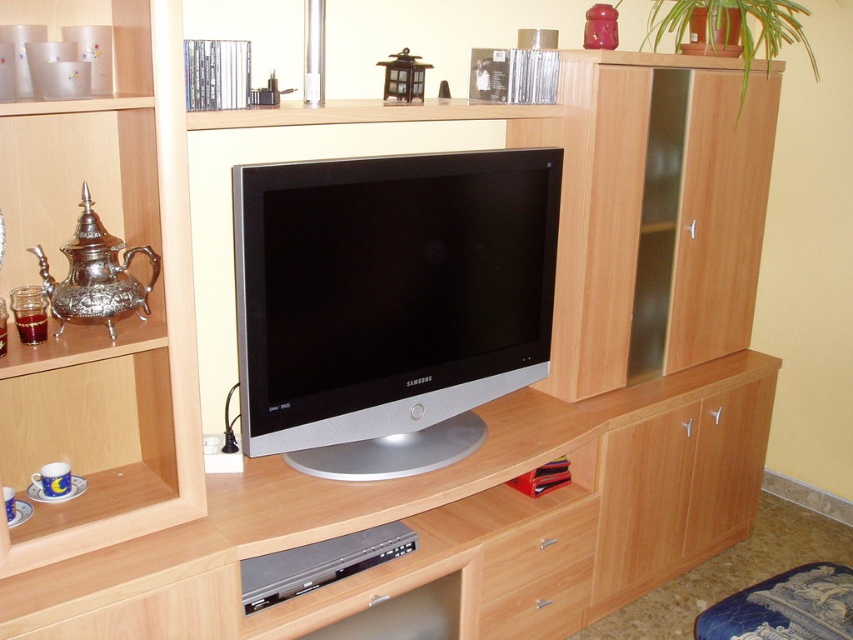
Question: Does matte silver teapot at left appear under wooden drawer at lower center?

Choices:
 (A) no
 (B) yes

Answer: (A)

Question: Based on their relative distances, which object is nearer to the satin silver flat at center?

Choices:
 (A) wooden drawer at lower center
 (B) matte silver teapot at left

Answer: (B)

Question: Does satin silver flat at center appear under wooden drawer at lower center?

Choices:
 (A) yes
 (B) no

Answer: (B)

Question: Which object appears farthest from the camera in this image?

Choices:
 (A) matte silver teapot at left
 (B) satin silver flat at center

Answer: (B)

Question: Observing the image, what is the correct spatial positioning of matte silver teapot at left in reference to wooden drawer at lower center?

Choices:
 (A) right
 (B) left

Answer: (B)

Question: Which is farther from the matte silver teapot at left?

Choices:
 (A) satin silver flat at center
 (B) wooden drawer at lower center

Answer: (B)